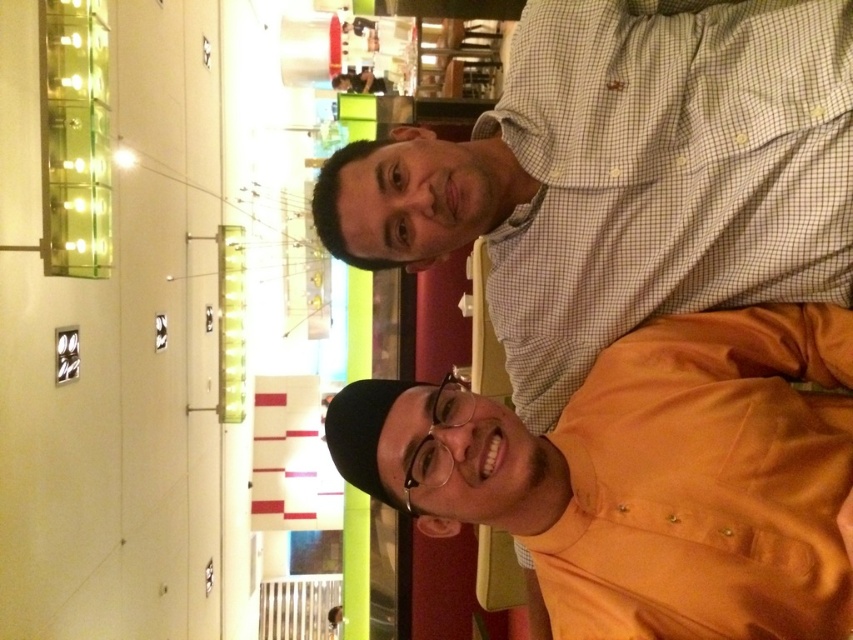
Can you confirm if orange satin shirt at upper right is positioned to the right of white checkered shirt at upper right?

No, orange satin shirt at upper right is not to the right of white checkered shirt at upper right.

Find the location of a particular element. This screenshot has width=853, height=640. orange satin shirt at upper right is located at coordinates (646, 476).